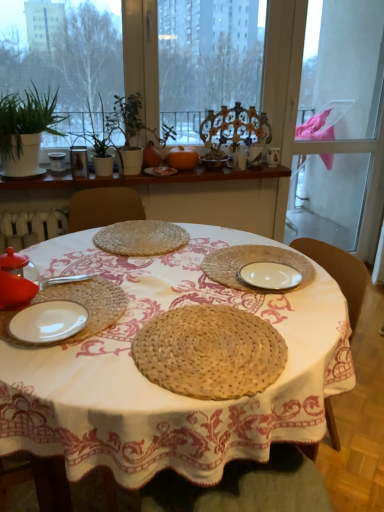
What are the coordinates of `vacant space behind white glossy plate at lower left, the fifth plate viewed from the top` in the screenshot? It's located at (84, 289).